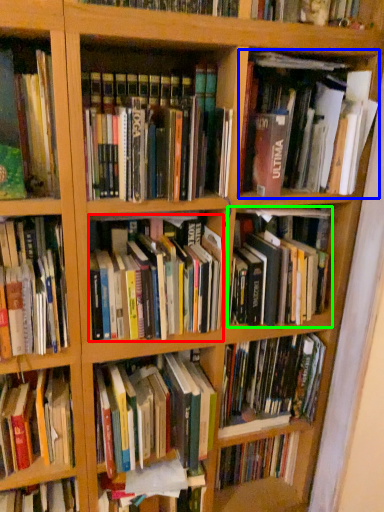
Question: Considering the real-world distances, which object is farthest from book (highlighted by a red box)? book (highlighted by a blue box) or book (highlighted by a green box)?

Choices:
 (A) book
 (B) book

Answer: (A)